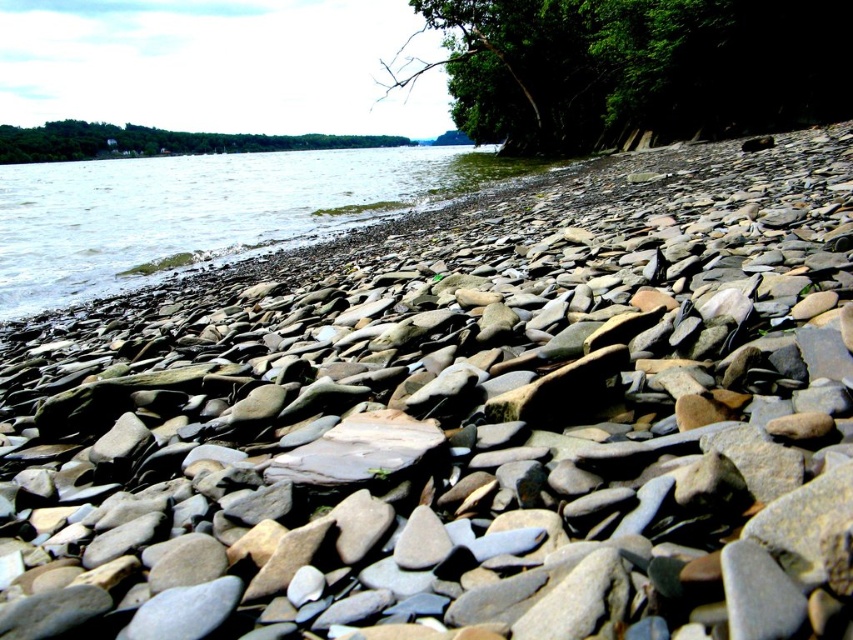
Question: Among these points, which one is farthest from the camera?

Choices:
 (A) (136, 134)
 (B) (637, 10)
 (C) (71, 253)

Answer: (A)

Question: Which of these objects is positioned closest to the green leafy tree at upper right?

Choices:
 (A) green leafy tree at upper center
 (B) clear water at lower left

Answer: (B)

Question: Is clear water at lower left above green leafy tree at upper center?

Choices:
 (A) no
 (B) yes

Answer: (A)

Question: Which point is closer to the camera?

Choices:
 (A) green leafy tree at upper center
 (B) green leafy tree at upper right

Answer: (B)

Question: Does green leafy tree at upper right appear on the left side of clear water at lower left?

Choices:
 (A) yes
 (B) no

Answer: (B)

Question: Is green leafy tree at upper right to the left of clear water at lower left from the viewer's perspective?

Choices:
 (A) yes
 (B) no

Answer: (B)